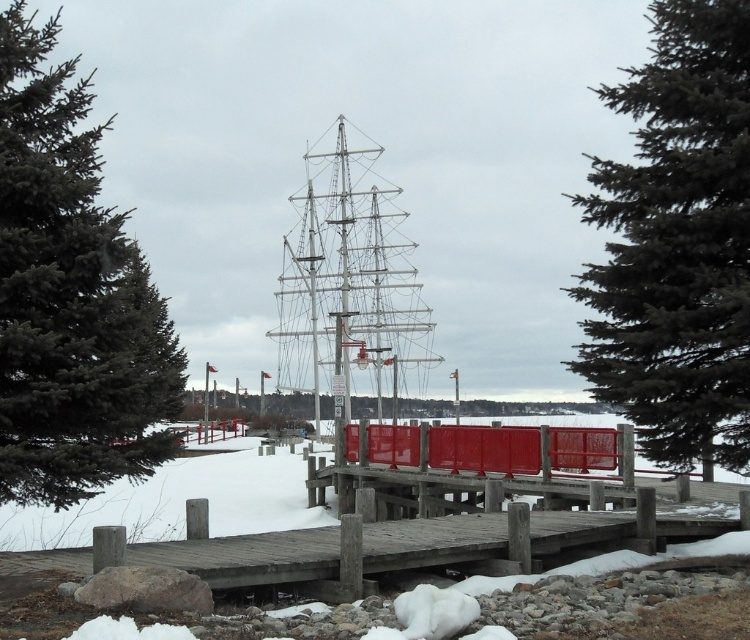
You are an architect designing a new lighting system for the dock. You need to place a spotlight at the exact center of the dock to illuminate the green matte tree at upper right. Given the coordinates of the tree, can you determine if the tree is positioned to the left or right of the dock center?

The green matte tree at upper right is located at coordinates (676,243). Since the dock extends into the water and the tree is at the upper right, it is positioned to the right of the dock center.

Looking at this image, you are an artist planning to paint the winter scene. You want to ensure the green matte tree at upper right and the white metallic boat at center are proportionally accurate. Which object should you make wider in your painting?

The green matte tree at upper right should be made wider in the painting since its width surpasses that of the white metallic boat at center.